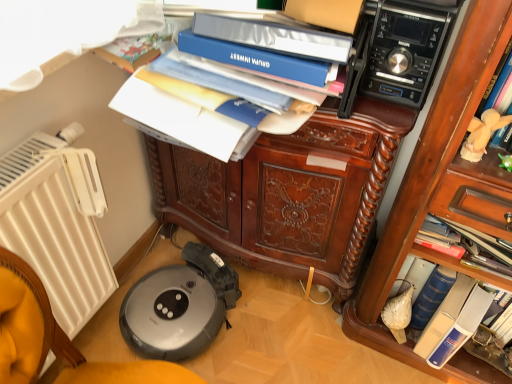
Question: Is point (66, 140) closer or farther from the camera than point (199, 44)?

Choices:
 (A) farther
 (B) closer

Answer: (A)

Question: In terms of width, does white plastic radiator at left look wider or thinner when compared to blue matte folder at upper center, marked as the 1th paperback book in a front-to-back arrangement?

Choices:
 (A) wide
 (B) thin

Answer: (A)

Question: Which object is positioned closest to the white plastic radiator at left?

Choices:
 (A) brown polished wood cabinet at center
 (B) blue hardcover book at lower right
 (C) white plush toy at upper right
 (D) black plastic stereo at upper right
 (E) blue matte folder at upper center

Answer: (A)

Question: Estimate the real-world distances between objects in this image. Which object is farther from the blue matte folder at upper center, which is the first paperback book from left to right?

Choices:
 (A) white plush toy at upper right
 (B) blue hardcover book at lower right
 (C) white plastic radiator at left
 (D) black plastic stereo at upper right
 (E) brown polished wood cabinet at center

Answer: (B)